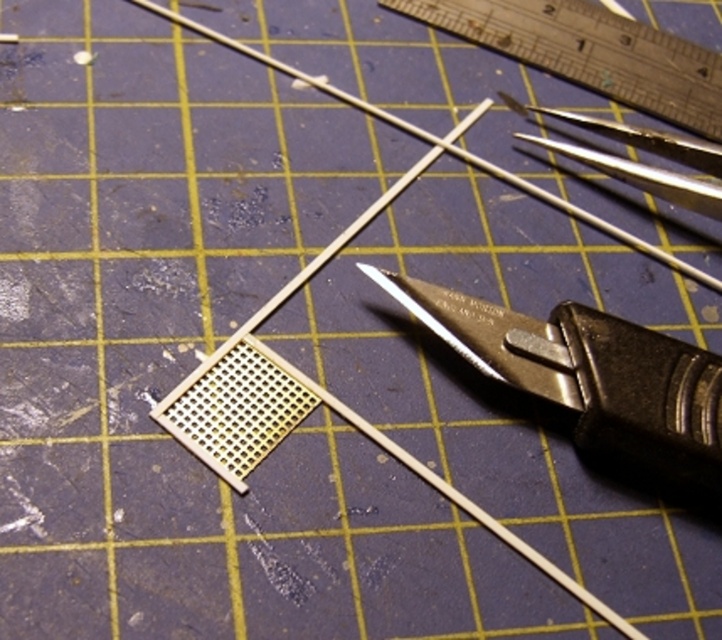
Does metallic silver ruler at upper right have a greater height compared to metallic silver scissors at upper right?

Yes, metallic silver ruler at upper right is taller than metallic silver scissors at upper right.

Can you confirm if metallic silver ruler at upper right is positioned to the left of metallic silver scissors at upper right?

Yes, metallic silver ruler at upper right is to the left of metallic silver scissors at upper right.

Does point (705, 97) come behind point (639, 131)?

Yes, it is.

The image size is (722, 640). I want to click on metallic silver ruler at upper right, so click(591, 52).

Does black plastic utility knife at center appear on the right side of metallic silver ruler at upper right?

Incorrect, black plastic utility knife at center is not on the right side of metallic silver ruler at upper right.

Which is in front, point (630, 420) or point (648, 100)?

Positioned in front is point (630, 420).

Find the location of a particular element. This screenshot has height=640, width=722. black plastic utility knife at center is located at coordinates (591, 376).

Is black plastic utility knife at center to the right of metallic silver scissors at upper right from the viewer's perspective?

Incorrect, black plastic utility knife at center is not on the right side of metallic silver scissors at upper right.

Locate an element on the screen. This screenshot has width=722, height=640. black plastic utility knife at center is located at coordinates (591, 376).